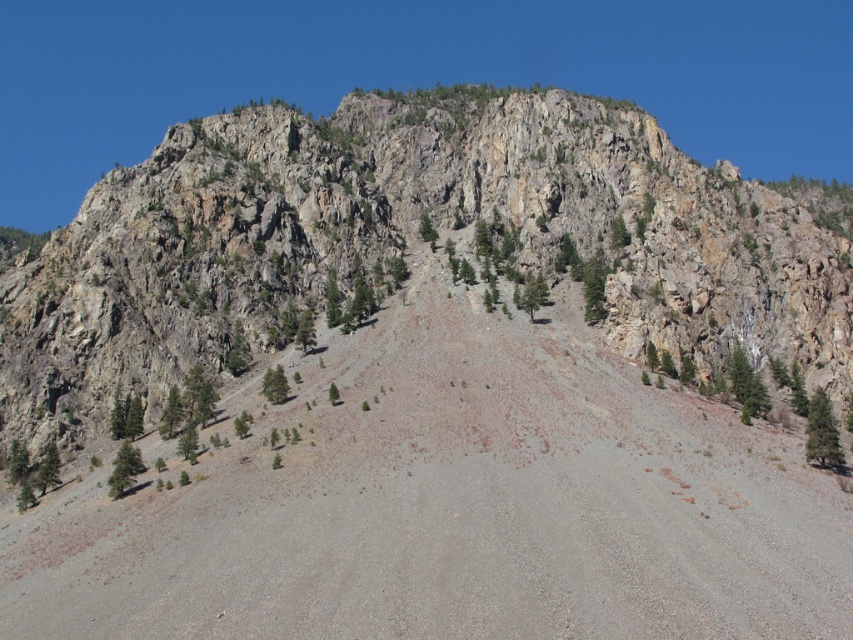
You are a hiker planning to climb the rocky cliff at upper center. You notice the gray gravel dirt track at center nearby. Which path has a lower elevation to start your climb?

The gray gravel dirt track at center has a lesser height compared to the rocky cliff at upper center, so starting from the gray gravel dirt track at center would provide a lower elevation starting point for the climb.

You are a hiker planning to set up a campsite on the gray gravel dirt track at center. You want to ensure that your campsite is at least 30 meters away from the rocky cliff at upper center for safety reasons. Based on the image, is the distance sufficient?

The distance between the gray gravel dirt track at center and the rocky cliff at upper center is 28.39 meters, which is less than the required 30 meters. Therefore, the campsite would not meet the safety requirement.